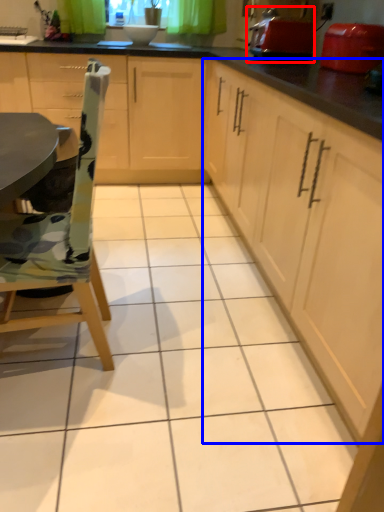
Question: Which point is further to the camera, appliance (highlighted by a red box) or cabinetry (highlighted by a blue box)?

Choices:
 (A) appliance
 (B) cabinetry

Answer: (A)